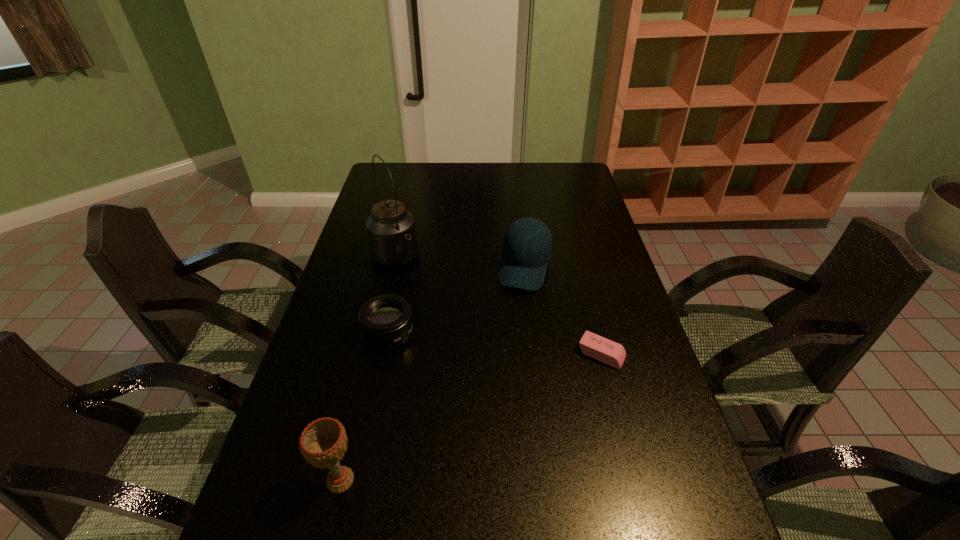
Find the location of a particular element. The height and width of the screenshot is (540, 960). free space that satisfies the following two spatial constraints: 1. on the front side of the baseball cap; 2. on the left side of the shortest object is located at coordinates (536, 354).

What are the coordinates of `vacant space that satisfies the following two spatial constraints: 1. on the back side of the fourth shortest object; 2. on the left side of the telephoto lens` in the screenshot? It's located at (375, 334).

Locate an element on the screen. free location that satisfies the following two spatial constraints: 1. on the front side of the telephoto lens; 2. on the left side of the tallest object is located at coordinates (377, 334).

Where is `free spot that satisfies the following two spatial constraints: 1. on the front side of the telephoto lens; 2. on the right side of the shortest object`? free spot that satisfies the following two spatial constraints: 1. on the front side of the telephoto lens; 2. on the right side of the shortest object is located at coordinates (385, 354).

Where is `free region that satisfies the following two spatial constraints: 1. on the back side of the second tallest object; 2. on the right side of the telephoto lens`? The height and width of the screenshot is (540, 960). free region that satisfies the following two spatial constraints: 1. on the back side of the second tallest object; 2. on the right side of the telephoto lens is located at coordinates [x=375, y=334].